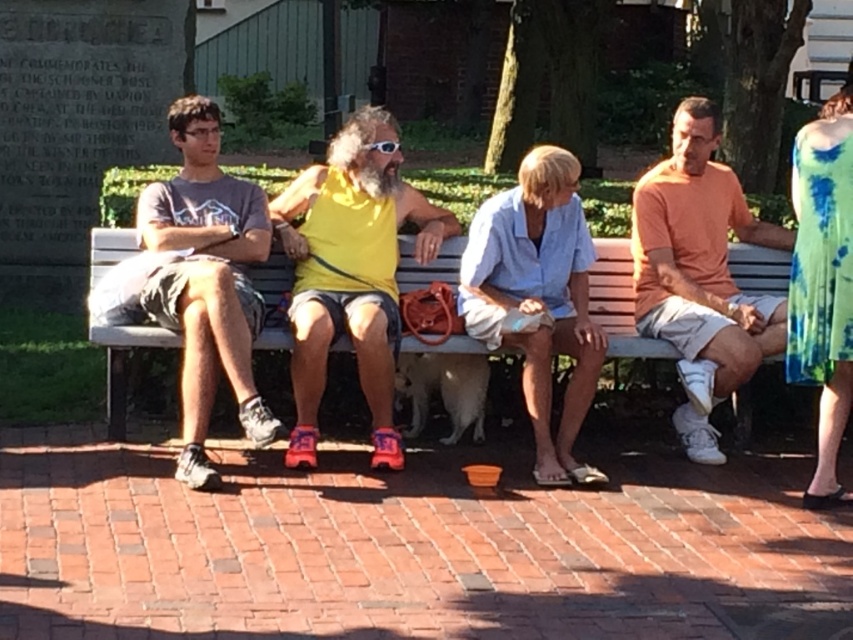
Is the position of matte gray t-shirt at left less distant than that of wooden bench at center?

That is True.

Is matte gray t-shirt at left to the left of wooden bench at center from the viewer's perspective?

Indeed, matte gray t-shirt at left is positioned on the left side of wooden bench at center.

Measure the distance between point (170, 266) and camera.

They are 6.95 meters apart.

Locate an element on the screen. matte gray t-shirt at left is located at coordinates tap(196, 282).

Who is shorter, yellow matte tank top at center or orange cotton shirt at right?

With less height is yellow matte tank top at center.

Can you confirm if yellow matte tank top at center is thinner than orange cotton shirt at right?

Incorrect, yellow matte tank top at center's width is not less than orange cotton shirt at right's.

Is point (320, 284) less distant than point (694, 440)?

Yes, it is.

At what (x,y) coordinates should I click in order to perform the action: click on yellow matte tank top at center. Please return your answer as a coordinate pair (x, y). Looking at the image, I should click on (351, 273).

At what (x,y) coordinates should I click in order to perform the action: click on orange cotton shirt at right. Please return your answer as a coordinate pair (x, y). This screenshot has height=640, width=853. Looking at the image, I should click on (700, 273).

Measure the distance from orange cotton shirt at right to wooden bench at center.

The distance of orange cotton shirt at right from wooden bench at center is 17.30 inches.

Is point (767, 349) positioned in front of point (614, 310)?

Yes, it is in front of point (614, 310).

At what (x,y) coordinates should I click in order to perform the action: click on orange cotton shirt at right. Please return your answer as a coordinate pair (x, y). The image size is (853, 640). Looking at the image, I should click on (700, 273).